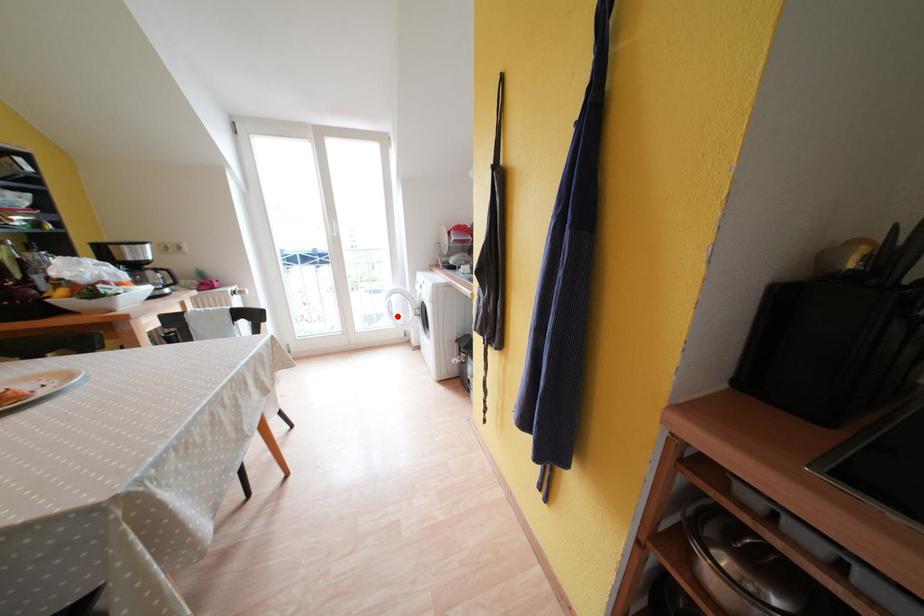
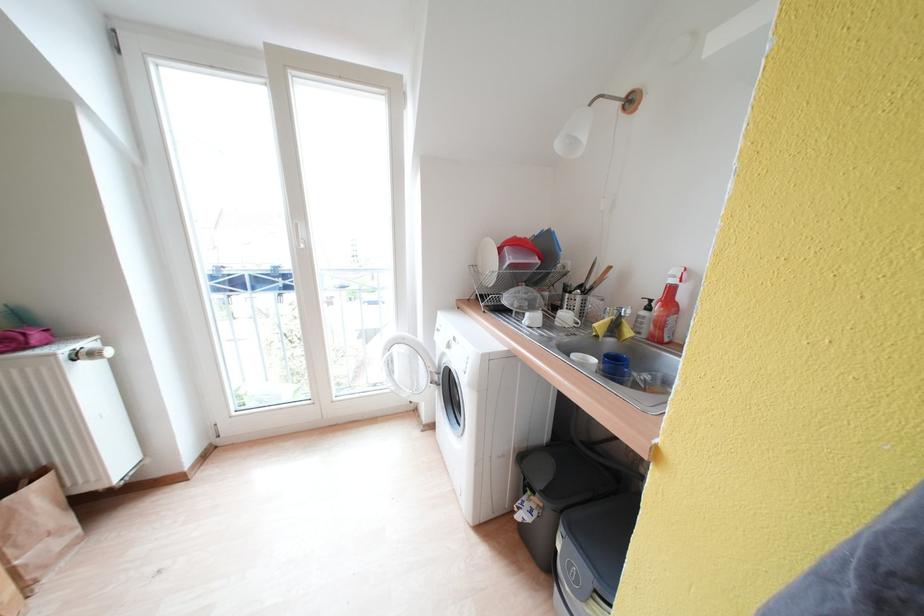
Question: A red point is marked in image1. In image2, is the corresponding 3D point closer to the camera or farther? Reply with the corresponding letter.

Choices:
 (A) The corresponding 3D point is closer.
 (B) The corresponding 3D point is farther.

Answer: (B)